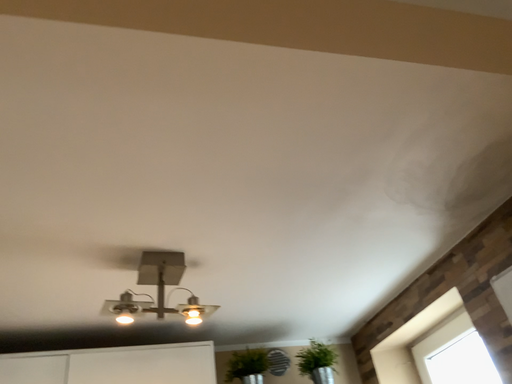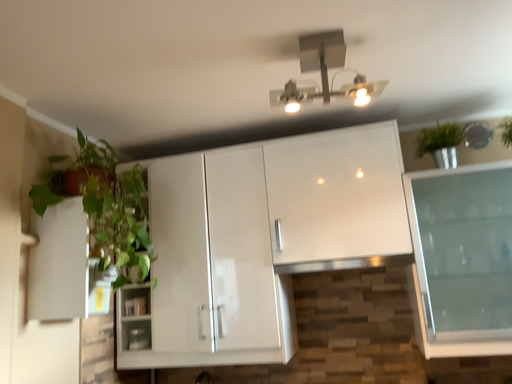
Question: Which way did the camera rotate in the video?

Choices:
 (A) rotated downward
 (B) rotated upward

Answer: (A)